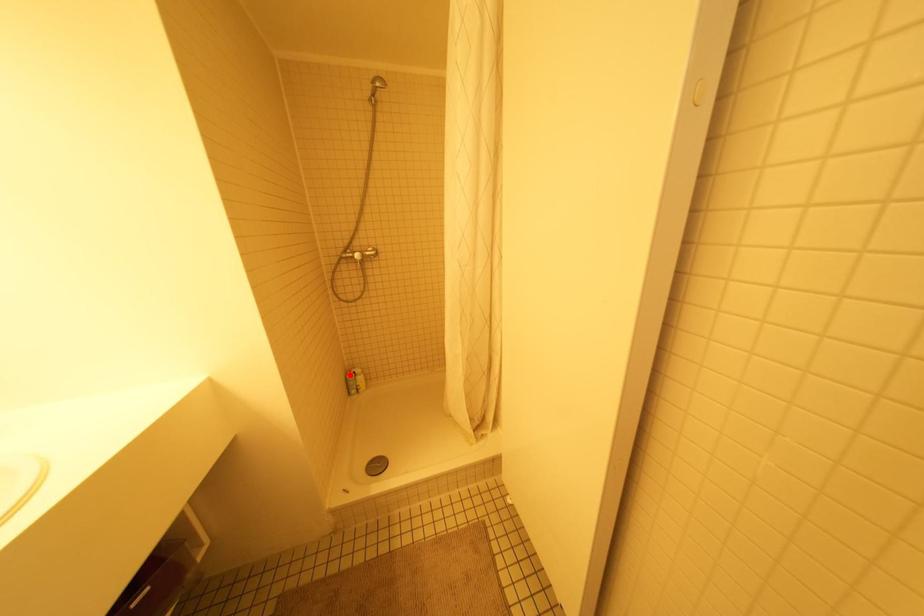
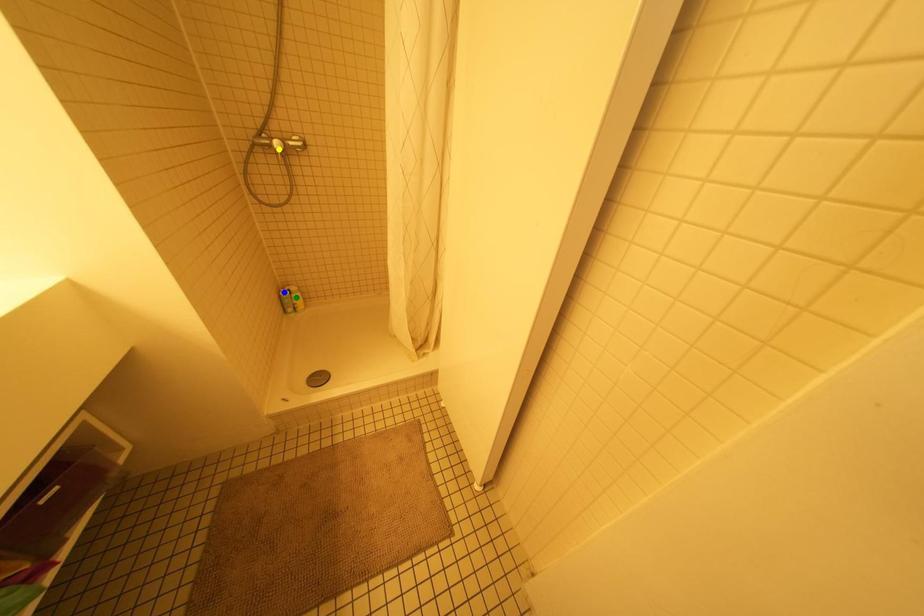
Question: I am providing you with two images of the same scene from different viewpoints. A red point is marked on the first image. You are given multiple points on the second image. Which spot in image 2 lines up with the point in image 1?

Choices:
 (A) green point
 (B) blue point
 (C) yellow point

Answer: (B)